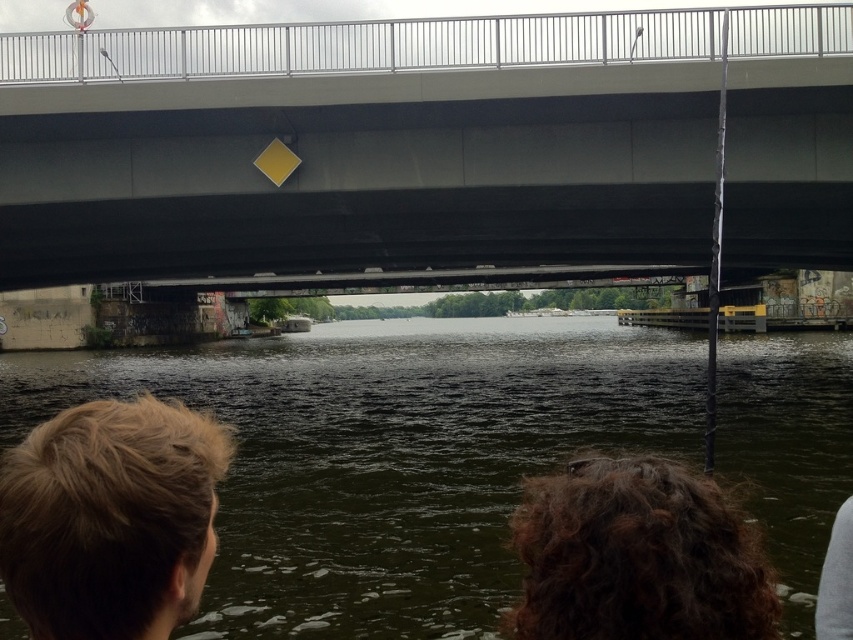
You are standing at the center of the bridge and want to take a photo of the blonde hair at lower left. Which direction should you point your camera to capture it?

You should point your camera to the lower left direction to capture the blonde hair at lower left, as it is located at point (111, 518) which is in the lower left area of the image.

You are a delivery drone with a wingspan of 4 feet. You need to fly from the smooth concrete bridge at center to the gray fabric at lower right. Can you safely navigate the space between them without hitting either object?

The smooth concrete bridge at center and gray fabric at lower right are 58.44 feet apart from each other. Since your wingspan is only 4 feet, the distance between them is more than sufficient for safe passage. Yes, you can navigate safely between them.